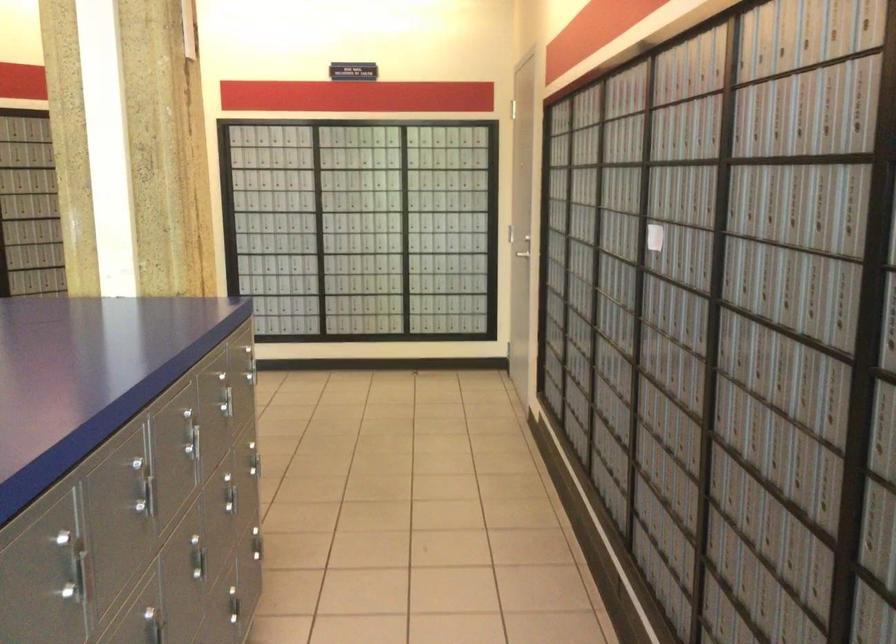
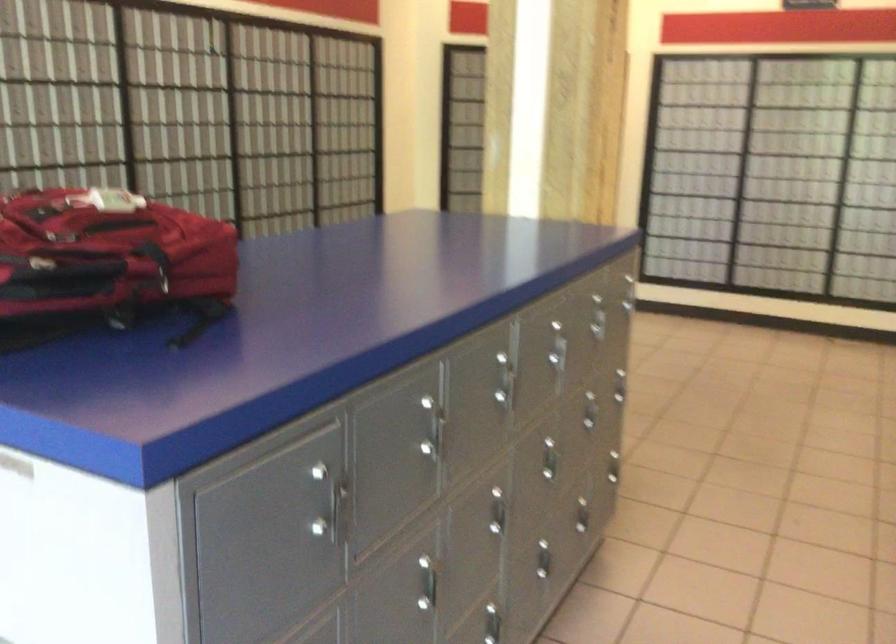
Locate, in the second image, the point that corresponds to [142,484] in the first image.

(503, 381)